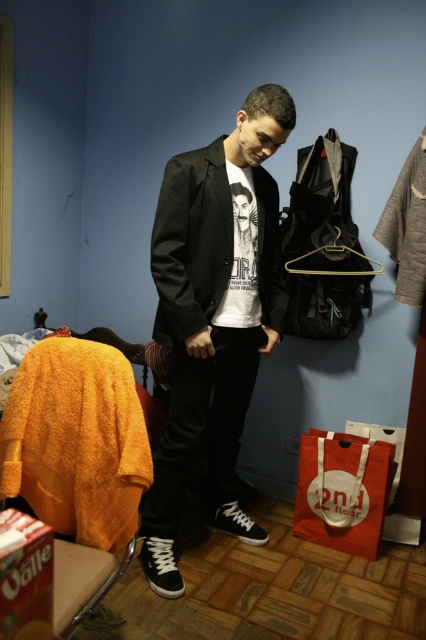
You are a delivery robot entering the room and need to place a package on the floor near the orange fuzzy sweater at left without hitting the matte black sneakers at lower left. Can you do it?

The matte black sneakers at lower left is further to the viewer than the orange fuzzy sweater at left, so the sneakers are closer to you. You can place the package near the orange fuzzy sweater at left while avoiding the sneakers since the sweater is farther away.